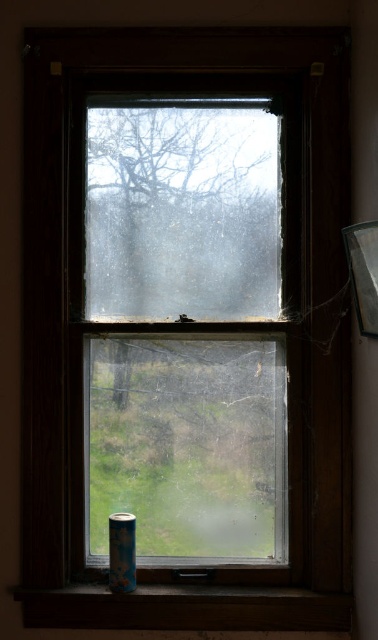
Question: Which point is farther to the camera?

Choices:
 (A) wooden at lower center
 (B) transparent glass window at center

Answer: (B)

Question: Which point is closer to the camera?

Choices:
 (A) (147, 596)
 (B) (268, 305)

Answer: (A)

Question: Is transparent glass window at center to the right of wooden at lower center from the viewer's perspective?

Choices:
 (A) yes
 (B) no

Answer: (B)

Question: From the image, what is the correct spatial relationship of transparent glass window at center in relation to wooden at lower center?

Choices:
 (A) right
 (B) left

Answer: (B)

Question: Is transparent glass window at center smaller than wooden at lower center?

Choices:
 (A) yes
 (B) no

Answer: (B)

Question: Which point is farther to the camera?

Choices:
 (A) transparent glass window at center
 (B) wooden at lower center

Answer: (A)